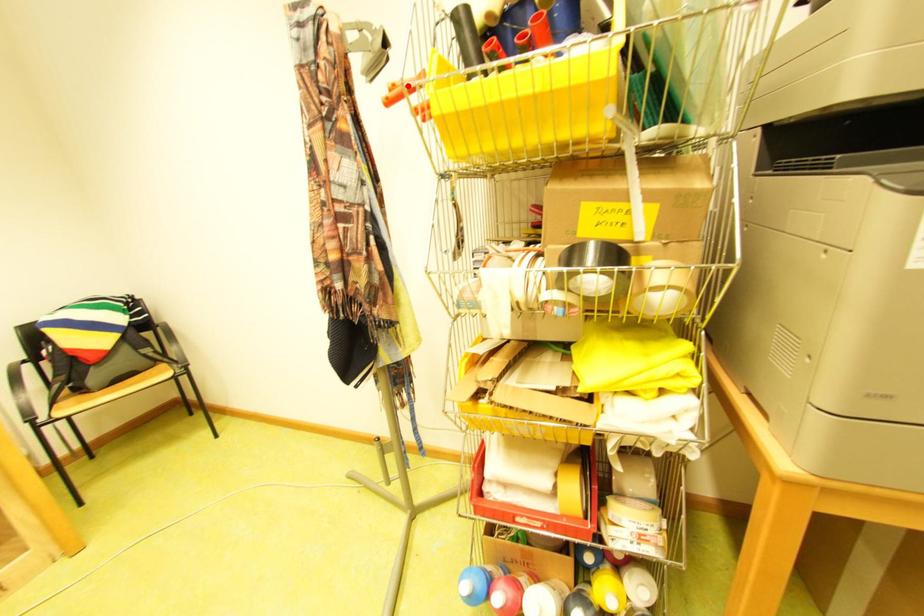
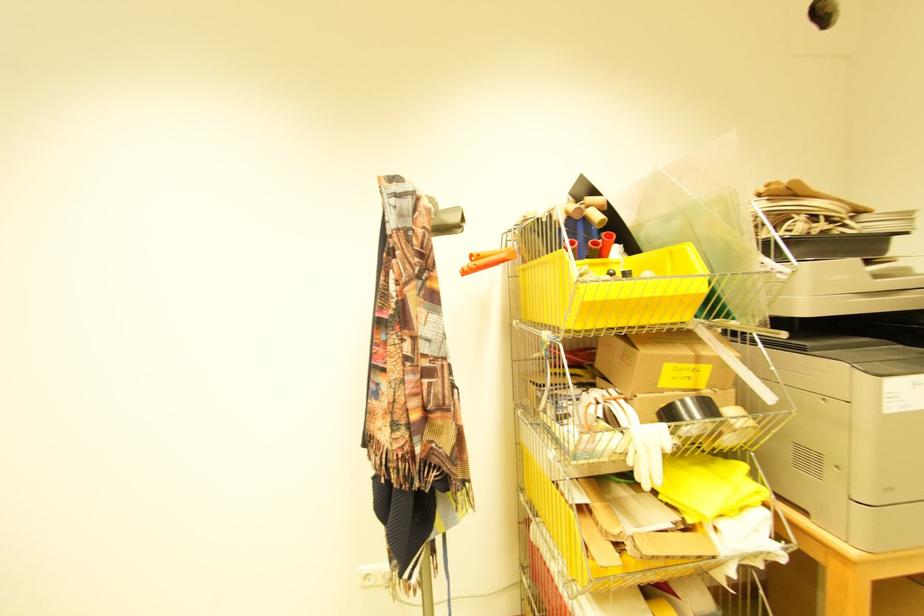
In the second image, find the point that corresponds to the highlighted location in the first image.

(492, 254)